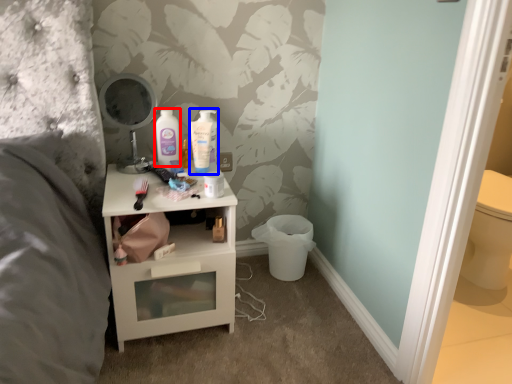
Question: Which object is closer to the camera taking this photo, mouthwash (highlighted by a red box) or mouthwash (highlighted by a blue box)?

Choices:
 (A) mouthwash
 (B) mouthwash

Answer: (A)